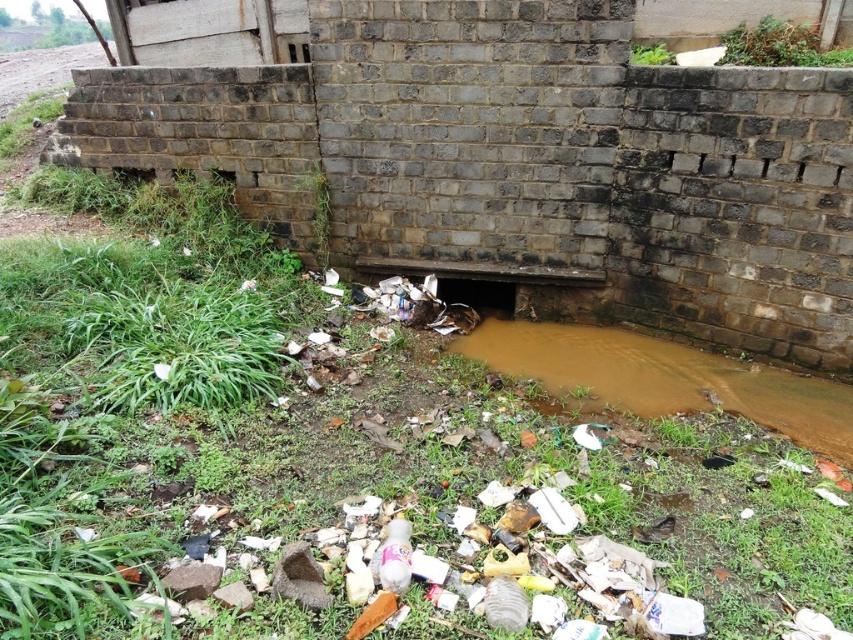
Question: Which of the following is the closest to the observer?

Choices:
 (A) tap(490, 285)
 (B) tap(579, 346)

Answer: (B)

Question: Which point is closer to the camera taking this photo?

Choices:
 (A) (828, 419)
 (B) (476, 296)

Answer: (A)

Question: Considering the relative positions of brown muddy stream at center and black rubber hole at center in the image provided, where is brown muddy stream at center located with respect to black rubber hole at center?

Choices:
 (A) above
 (B) below

Answer: (B)

Question: Among these objects, which one is farthest from the camera?

Choices:
 (A) brown muddy stream at center
 (B) black rubber hole at center

Answer: (B)

Question: Can you confirm if brown muddy stream at center is positioned to the left of black rubber hole at center?

Choices:
 (A) no
 (B) yes

Answer: (A)

Question: Can you confirm if brown muddy stream at center is positioned to the left of black rubber hole at center?

Choices:
 (A) yes
 (B) no

Answer: (B)